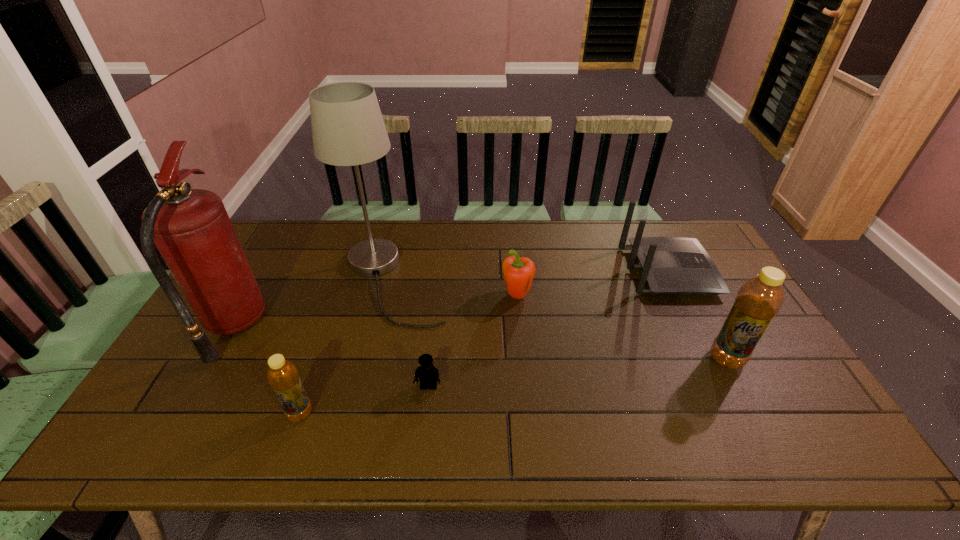
Find the location of a particular element. free space between the shorter bottle and the table lamp is located at coordinates (347, 347).

This screenshot has width=960, height=540. Identify the location of free point between the table lamp and the sixth farthest object. (411, 334).

At what (x,y) coordinates should I click in order to perform the action: click on free area in between the table lamp and the taller bottle. Please return your answer as a coordinate pair (x, y). Looking at the image, I should click on (560, 320).

Find the location of `free point between the shortest object and the table lamp`. free point between the shortest object and the table lamp is located at coordinates (411, 334).

The height and width of the screenshot is (540, 960). I want to click on free spot between the pepper and the router, so click(x=592, y=284).

Find the location of a particular element. The image size is (960, 540). free space between the pepper and the router is located at coordinates (592, 284).

Locate an element on the screen. The width and height of the screenshot is (960, 540). free spot between the second nearest object and the router is located at coordinates (548, 329).

Image resolution: width=960 pixels, height=540 pixels. What are the coordinates of `empty location between the fifth object from left to right and the router` in the screenshot? It's located at (592, 284).

Image resolution: width=960 pixels, height=540 pixels. Identify the location of vacant area that lies between the router and the right bottle. (697, 315).

This screenshot has height=540, width=960. What are the coordinates of `the sixth closest object to the leftmost object` in the screenshot? It's located at (759, 299).